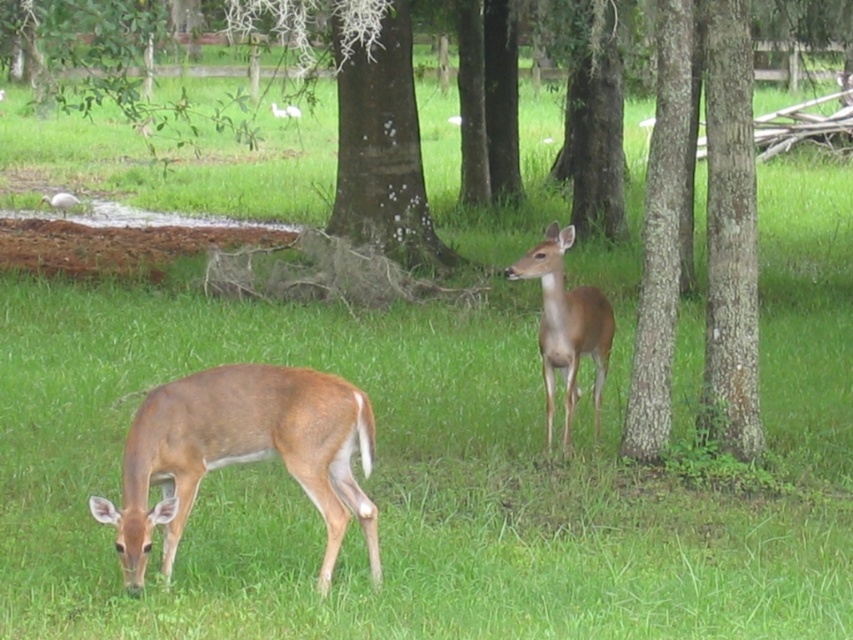
Does brown matte/deer at lower left have a larger size compared to brown matte/deer at center-right?

No.

Which is above, brown matte/deer at lower left or brown matte/deer at center-right?

brown matte/deer at center-right

Locate an element on the screen. The width and height of the screenshot is (853, 640). brown matte/deer at lower left is located at coordinates (242, 454).

Based on the photo, does brown matte/deer at lower left appear on the right side of white matte bird at upper left?

Correct, you'll find brown matte/deer at lower left to the right of white matte bird at upper left.

The width and height of the screenshot is (853, 640). Describe the element at coordinates (242, 454) in the screenshot. I see `brown matte/deer at lower left` at that location.

Where is `brown matte/deer at lower left`? The height and width of the screenshot is (640, 853). brown matte/deer at lower left is located at coordinates tap(242, 454).

Image resolution: width=853 pixels, height=640 pixels. Describe the element at coordinates (566, 324) in the screenshot. I see `brown matte/deer at center-right` at that location.

In order to click on brown matte/deer at center-right in this screenshot , I will do `click(566, 324)`.